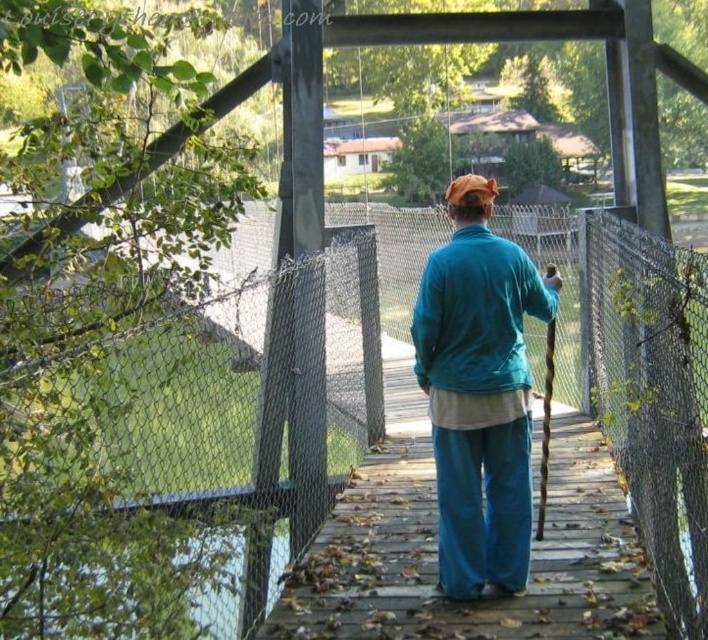
What do you see at coordinates (479, 392) in the screenshot? The width and height of the screenshot is (708, 640). I see `teal velvety jacket at center` at bounding box center [479, 392].

Between point (531, 308) and point (72, 566), which one is positioned in front?

Point (72, 566) is in front.

Does point (473, 342) lie in front of point (202, 572)?

No, (473, 342) is further to viewer.

The height and width of the screenshot is (640, 708). Identify the location of teal velvety jacket at center. (479, 392).